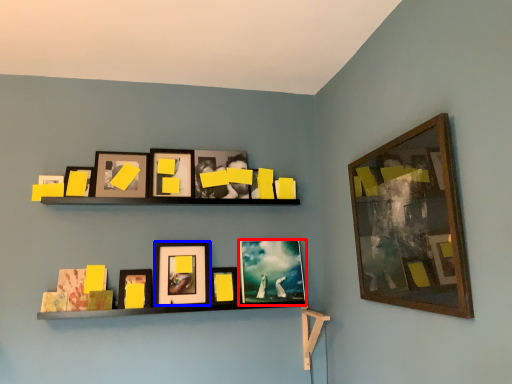
Question: Which of the following is the closest to the observer, picture frame (highlighted by a red box) or picture frame (highlighted by a blue box)?

Choices:
 (A) picture frame
 (B) picture frame

Answer: (B)